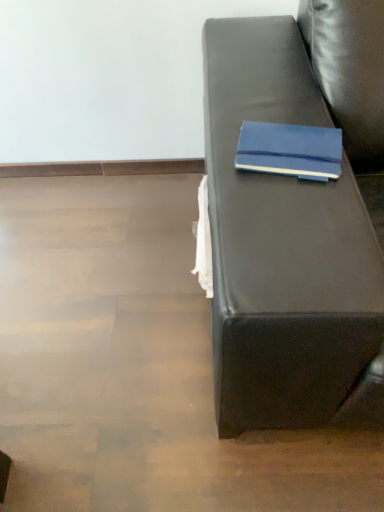
Measure the distance between blue matte notebook at center and camera.

blue matte notebook at center and camera are 72.27 centimeters apart from each other.

Image resolution: width=384 pixels, height=512 pixels. What do you see at coordinates (290, 150) in the screenshot?
I see `blue matte notebook at center` at bounding box center [290, 150].

What is the approximate width of blue matte notebook at center?

5.30 inches.

I want to click on blue matte notebook at center, so point(290,150).

Where is `blue matte notebook at center`? Image resolution: width=384 pixels, height=512 pixels. blue matte notebook at center is located at coordinates (290, 150).